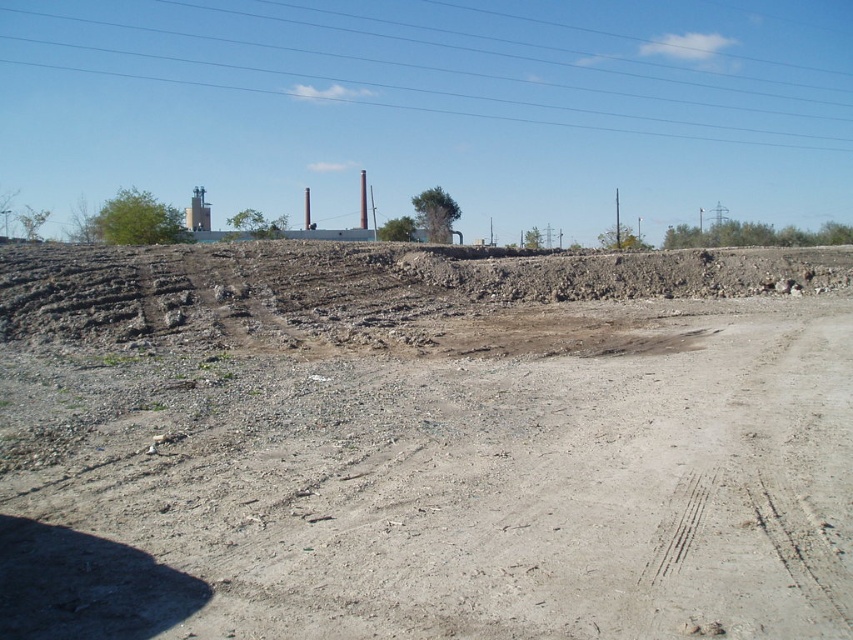
Question: Which of the following is the closest to the observer?

Choices:
 (A) clear blue sky at upper center
 (B) dull gray gravel at center

Answer: (B)

Question: From the image, what is the correct spatial relationship of dull gray gravel at center in relation to clear blue sky at upper center?

Choices:
 (A) below
 (B) above

Answer: (A)

Question: Which of the following is the closest to the observer?

Choices:
 (A) dull gray gravel at center
 (B) clear blue sky at upper center

Answer: (A)

Question: Which point is closer to the camera?

Choices:
 (A) (595, 522)
 (B) (759, 112)

Answer: (A)

Question: Does dull gray gravel at center appear on the left side of clear blue sky at upper center?

Choices:
 (A) no
 (B) yes

Answer: (A)

Question: Does dull gray gravel at center have a larger size compared to clear blue sky at upper center?

Choices:
 (A) no
 (B) yes

Answer: (A)